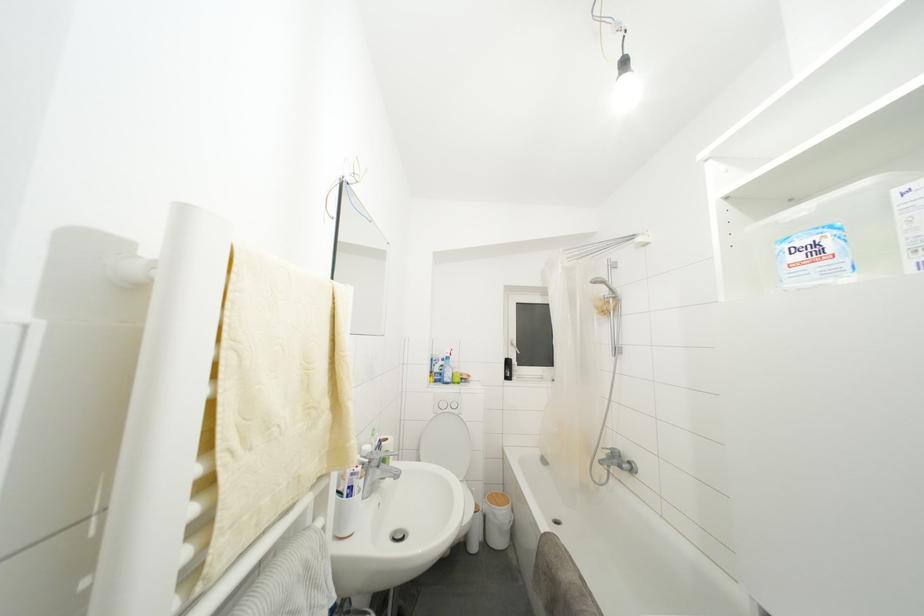
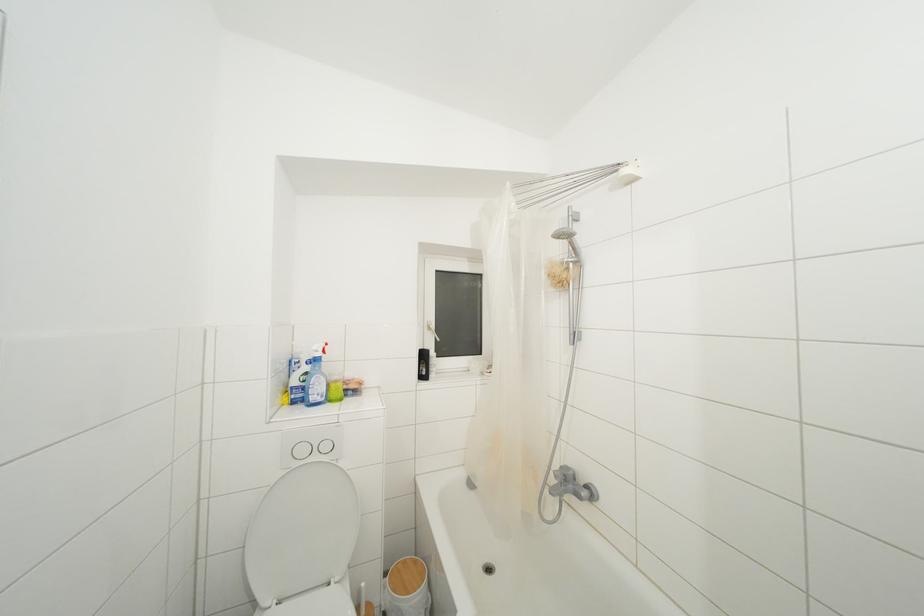
The point at (x=613, y=307) is marked in the first image. Where is the corresponding point in the second image?

(572, 273)